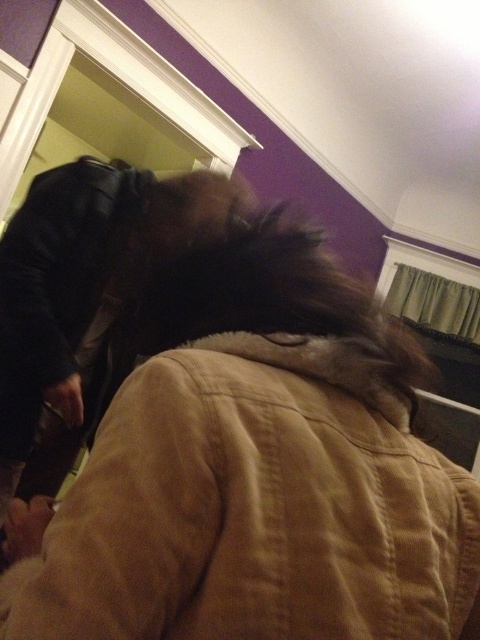
Does brown fur coat at upper center lie behind leather jacket at left?

No.

Find the location of a particular element. This screenshot has height=640, width=480. brown fur coat at upper center is located at coordinates (254, 470).

In order to click on brown fur coat at upper center in this screenshot , I will do `click(254, 470)`.